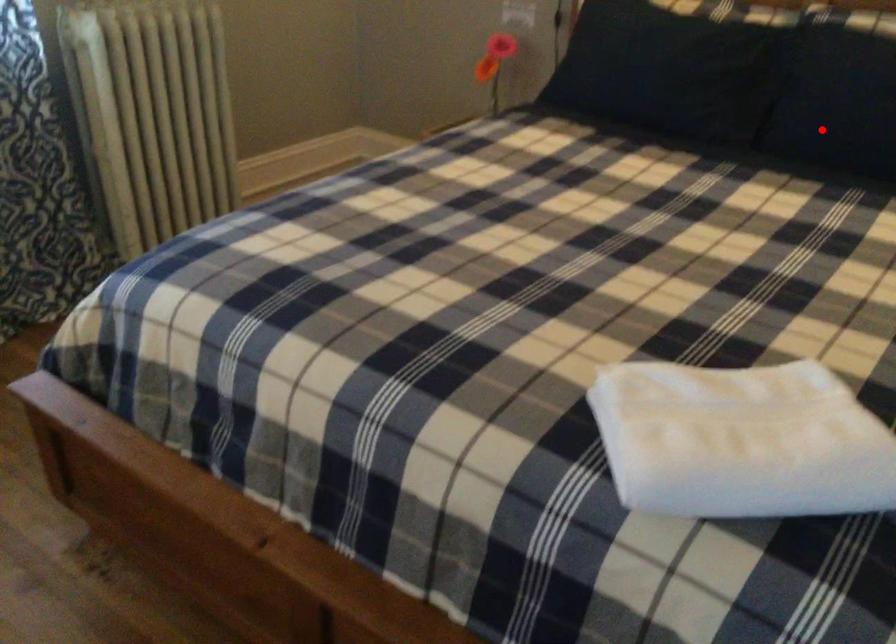
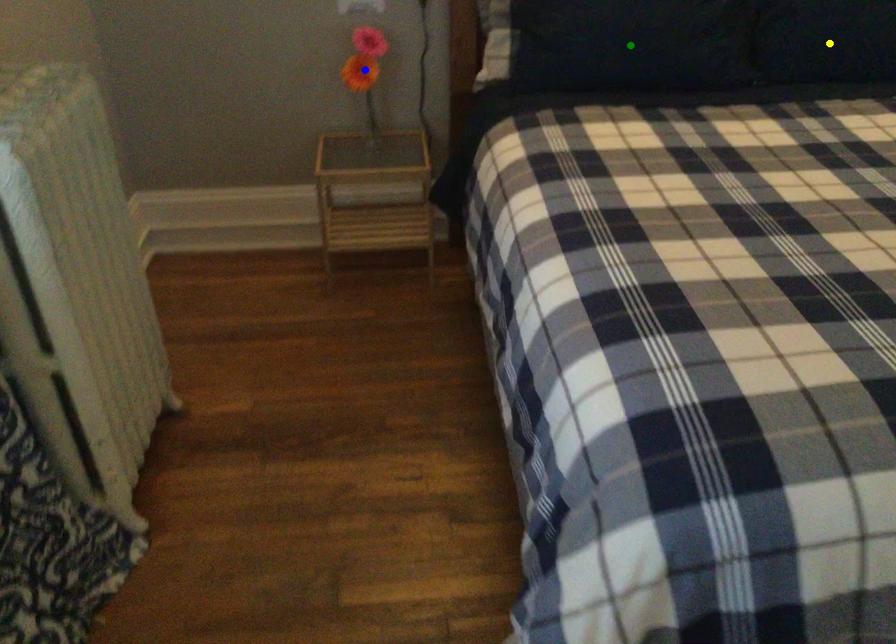
Question: I am providing you with two images of the same scene from different viewpoints. A red point is marked on the first image. You are given multiple points on the second image. Which mark in image 2 goes with the point in image 1?

Choices:
 (A) green point
 (B) blue point
 (C) yellow point

Answer: (C)